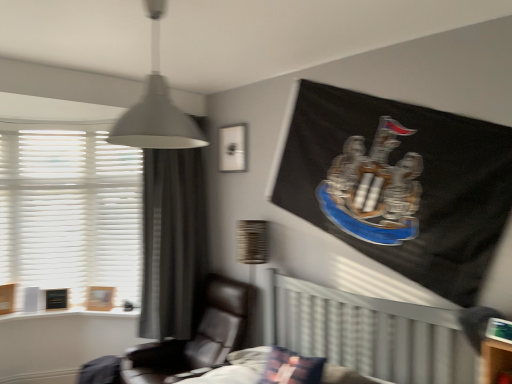
At what (x,y) coordinates should I click in order to perform the action: click on free location in front of wooden frame at lower left, which is the 1th picture frame in bottom-to-top order. Please return your answer as a coordinate pair (x, y). The width and height of the screenshot is (512, 384). Looking at the image, I should click on (100, 309).